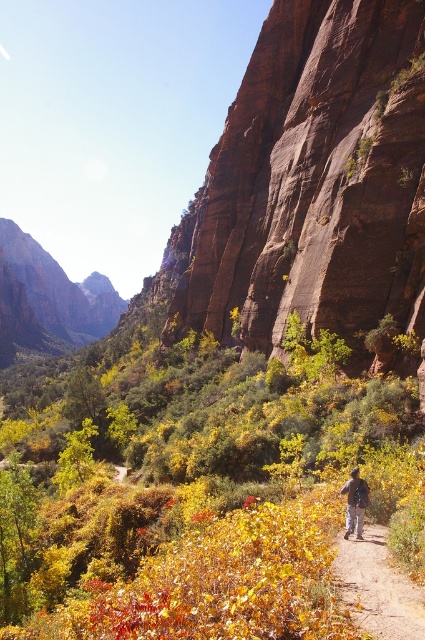
From the picture: You are a hiker trying to navigate the rugged mountain landscape. You see the dirt path at center and dark blue jeans at center. Which object is closer to the ground?

The dirt path at center is closer to the ground because it is positioned below the dark blue jeans at center.

You are a hiker trying to navigate through the mountainous landscape. You see the dirt path at center. Based on its position, can you determine if it leads towards the cliff face or away from it?

The dirt path at center is located at point [377,588], which is near the lower part of the image. Since the cliff face dominates the midground and background, the path likely leads towards the cliff face as it is positioned along the lower section where the terrain ascends towards the rocks.